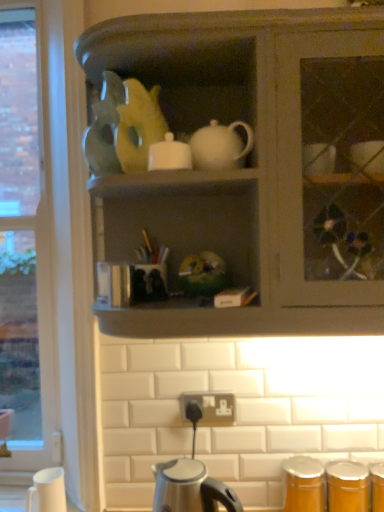
Question: Does satin silver kettle at lower center have a greater height compared to matte gray cabinet at center?

Choices:
 (A) yes
 (B) no

Answer: (B)

Question: Can you confirm if satin silver kettle at lower center is wider than matte gray cabinet at center?

Choices:
 (A) no
 (B) yes

Answer: (A)

Question: Does satin silver kettle at lower center come behind matte gray cabinet at center?

Choices:
 (A) no
 (B) yes

Answer: (B)

Question: Is satin silver kettle at lower center thinner than matte gray cabinet at center?

Choices:
 (A) no
 (B) yes

Answer: (B)

Question: Could you tell me if satin silver kettle at lower center is facing matte gray cabinet at center?

Choices:
 (A) no
 (B) yes

Answer: (A)

Question: In the image, is white glossy sugar bowl at upper center positioned in front of or behind satin silver kettle at lower center?

Choices:
 (A) front
 (B) behind

Answer: (B)

Question: Considering the positions of white glossy sugar bowl at upper center and satin silver kettle at lower center in the image, is white glossy sugar bowl at upper center taller or shorter than satin silver kettle at lower center?

Choices:
 (A) short
 (B) tall

Answer: (A)

Question: From the image's perspective, relative to satin silver kettle at lower center, is white glossy sugar bowl at upper center above or below?

Choices:
 (A) above
 (B) below

Answer: (A)

Question: Which is correct: white glossy sugar bowl at upper center is inside satin silver kettle at lower center, or outside of it?

Choices:
 (A) inside
 (B) outside

Answer: (B)

Question: From a real-world perspective, relative to white matte coffee cup at lower left, is satin silver kettle at lower center vertically above or below?

Choices:
 (A) below
 (B) above

Answer: (B)

Question: Relative to white matte coffee cup at lower left, is satin silver kettle at lower center in front or behind?

Choices:
 (A) front
 (B) behind

Answer: (A)

Question: From their relative heights in the image, would you say satin silver kettle at lower center is taller or shorter than white matte coffee cup at lower left?

Choices:
 (A) short
 (B) tall

Answer: (B)

Question: From the image's perspective, is satin silver kettle at lower center positioned above or below white matte coffee cup at lower left?

Choices:
 (A) below
 (B) above

Answer: (B)

Question: In terms of width, does matte gray cabinet at center look wider or thinner when compared to white glossy sugar bowl at upper center?

Choices:
 (A) wide
 (B) thin

Answer: (A)

Question: Considering their positions, is matte gray cabinet at center located in front of or behind white glossy sugar bowl at upper center?

Choices:
 (A) front
 (B) behind

Answer: (A)